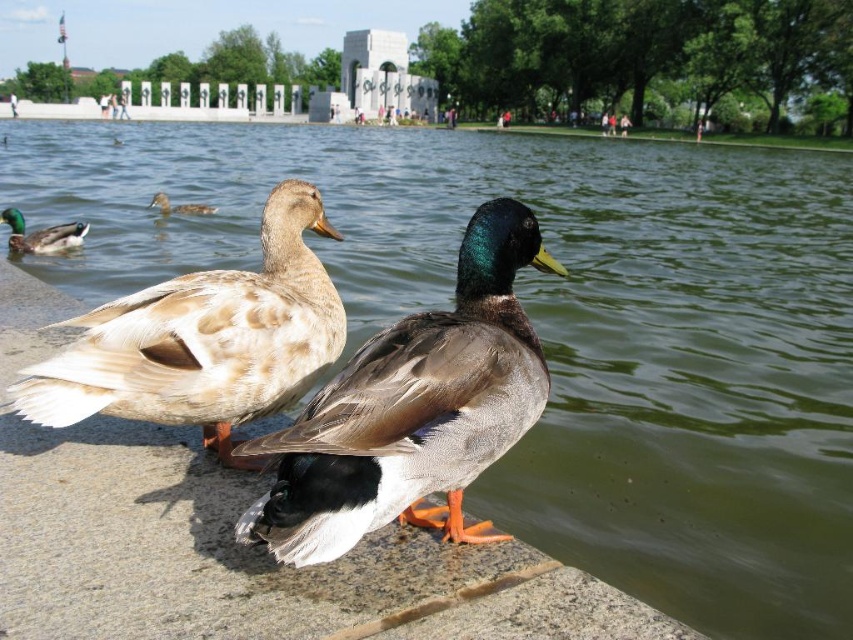
Question: Which point is farther from the camera taking this photo?

Choices:
 (A) (350, 488)
 (B) (169, 209)
 (C) (32, 412)

Answer: (B)

Question: Can you confirm if brown feathered duck at center is positioned to the right of brown matte duck at upper left?

Choices:
 (A) no
 (B) yes

Answer: (B)

Question: Considering the real-world distances, which object is closest to the brown matte duck at upper left?

Choices:
 (A) brown feathered duck at center
 (B) light brown leather jacket at upper center
 (C) shiny brown duck at center

Answer: (A)

Question: Can you confirm if brown feathered duck at center is positioned above brown matte duck at upper left?

Choices:
 (A) no
 (B) yes

Answer: (A)

Question: Considering the real-world distances, which object is closest to the shiny brown duck at center?

Choices:
 (A) brown feathered duck at center
 (B) brown matte duck at upper left

Answer: (A)

Question: Is shiny brown duck at center in front of brown matte duck at upper left?

Choices:
 (A) no
 (B) yes

Answer: (B)